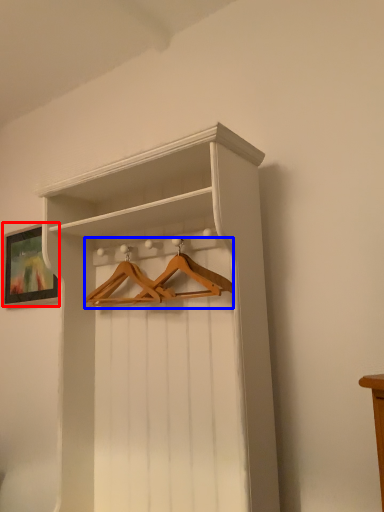
Question: Which point is closer to the camera, picture frame (highlighted by a red box) or hanger (highlighted by a blue box)?

Choices:
 (A) picture frame
 (B) hanger

Answer: (B)